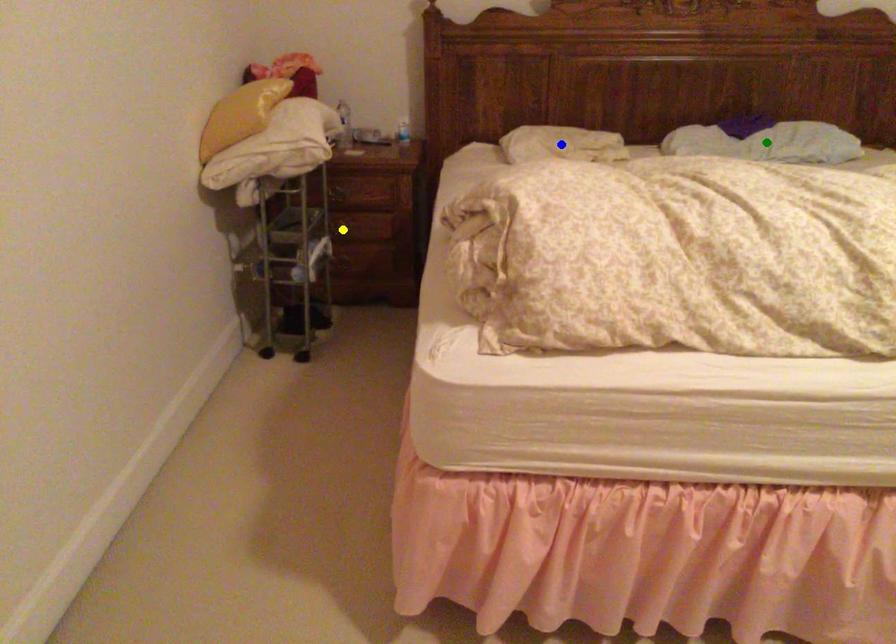
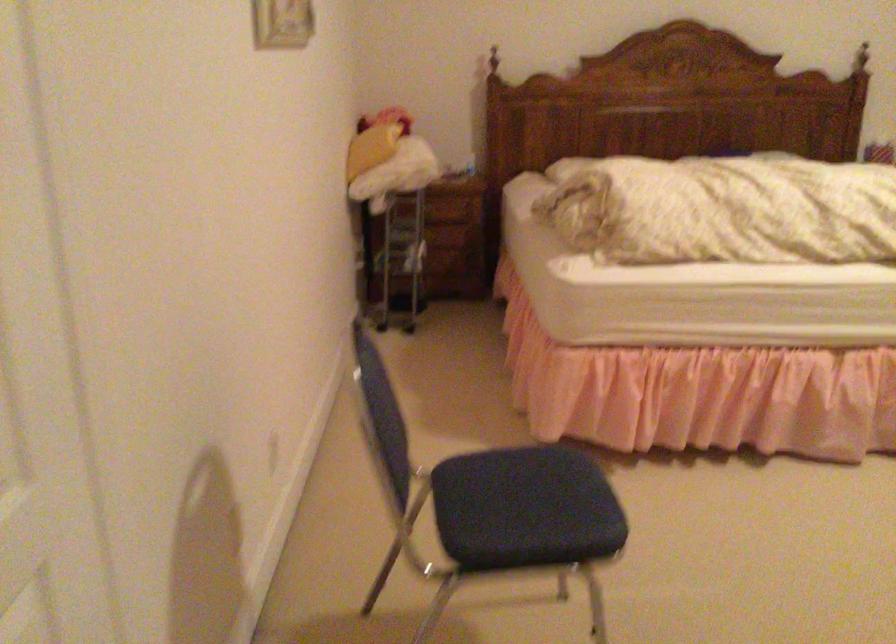
I am providing you with two images of the same scene from different viewpoints. Three points are marked in image1. Which point corresponds to a part or object that is occluded in image2?In image1, three points are marked. Which of them correspond to a part or object that is occluded in image2?Among the three points shown in image1, which one corresponds to a part or object that is no longer visible due to occlusion in image2?

green point, blue point, yellow point cannot be seen in image2.